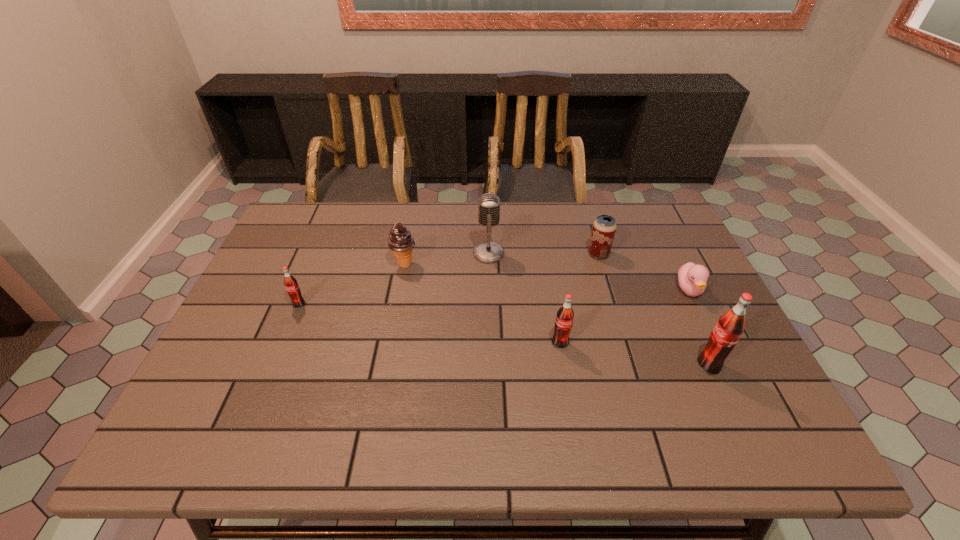
In the image, there is a desktop. Where is `vacant space at the far left corner`? The height and width of the screenshot is (540, 960). vacant space at the far left corner is located at coordinates (297, 213).

Locate an element on the screen. This screenshot has width=960, height=540. free point at the far right corner is located at coordinates (660, 231).

The width and height of the screenshot is (960, 540). I want to click on vacant area at the near right corner, so click(x=717, y=400).

Locate an element on the screen. The width and height of the screenshot is (960, 540). unoccupied position between the second shortest soda bottle and the microphone is located at coordinates (524, 299).

Identify the location of vacant point located between the icecream and the shortest object. (547, 277).

Where is `blank region between the farthest soda bottle and the icecream`? The image size is (960, 540). blank region between the farthest soda bottle and the icecream is located at coordinates (352, 285).

Identify the location of free area in between the third object from left to right and the nearest object. (598, 309).

The image size is (960, 540). I want to click on vacant space that's between the duckling and the second object from left to right, so click(547, 277).

Identify the location of vacant area that lies between the shortest object and the icecream. (547, 277).

Find the location of a particular element. vacant point located between the tallest soda bottle and the shortest object is located at coordinates (699, 328).